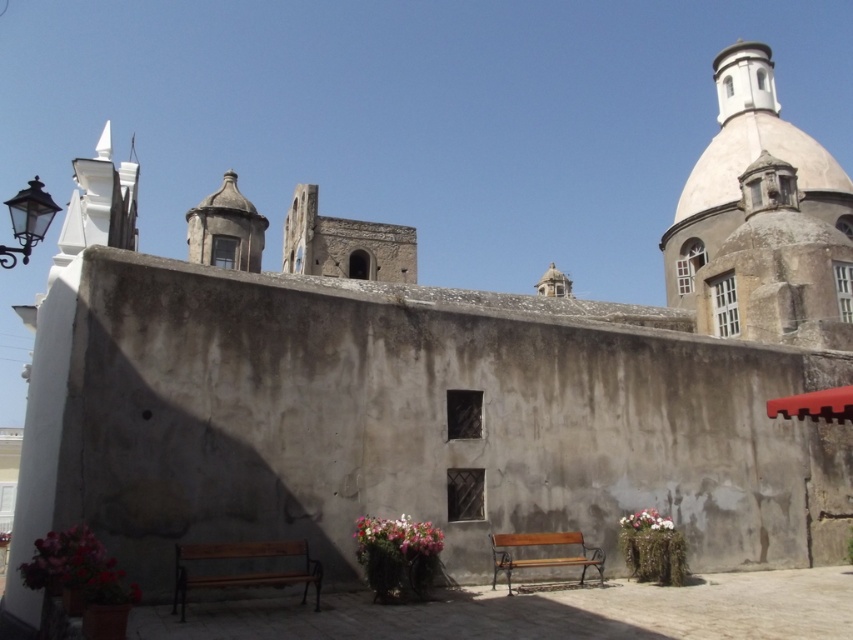
You are an interior designer planning to place a new sculpture in the courtyard. The sculpture requires a base that must be smaller than both the pink fabric flower at lower left and the wooden bench at center. Which object should the base be sized relative to to ensure it fits appropriately?

The base must be smaller than both the pink fabric flower at lower left and the wooden bench at center. Since the pink fabric flower at lower left is bigger than the wooden bench at center, the base should be sized relative to the pink fabric flower at lower left to ensure it is smaller than both.

You are an architect designing a new courtyard and want to ensure that the smooth beige dome at upper right and the pink fabric flowers at lower right will fit within the allocated space. Which object should you prioritize in terms of width when planning the layout?

The smooth beige dome at upper right might be wider than the pink fabric flowers at lower right, so you should prioritize the dome in terms of width when planning the layout to ensure sufficient space.